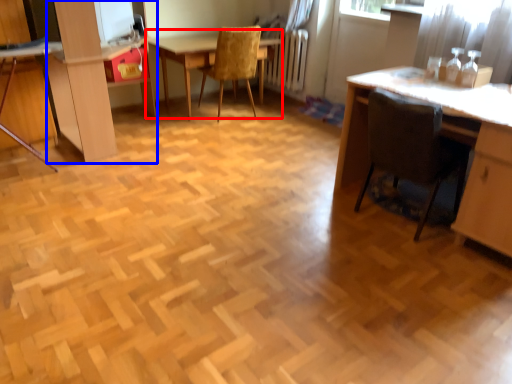
Question: Which of the following is the farthest to the observer, table (highlighted by a red box) or dresser (highlighted by a blue box)?

Choices:
 (A) table
 (B) dresser

Answer: (A)